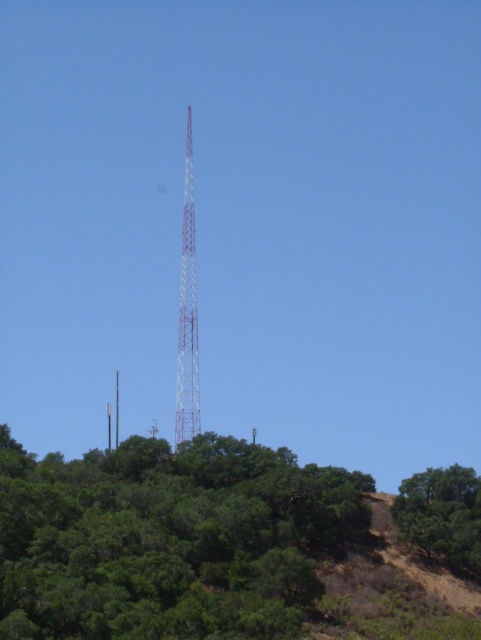
From the picture: Who is shorter, green leafy tree at center or metallic tower at center?

With less height is green leafy tree at center.

What are the coordinates of `green leafy tree at center` in the screenshot? It's located at (168, 540).

Which is behind, point (52, 596) or point (114, 435)?

The point (114, 435) is more distant.

At what (x,y) coordinates should I click in order to perform the action: click on green leafy tree at center. Please return your answer as a coordinate pair (x, y). The image size is (481, 640). Looking at the image, I should click on (168, 540).

Consider the image. Can you confirm if green leafy tree at lower right is positioned above metallic white tower at center?

Actually, green leafy tree at lower right is below metallic white tower at center.

Can you confirm if green leafy tree at lower right is positioned to the right of metallic white tower at center?

Indeed, green leafy tree at lower right is positioned on the right side of metallic white tower at center.

Is point (445, 518) positioned after point (200, 413)?

No.

The image size is (481, 640). In order to click on green leafy tree at lower right in this screenshot , I will do `click(442, 515)`.

Consider the image. Does metallic white tower at center have a smaller size compared to red painted metal tower at center?

No, metallic white tower at center is not smaller than red painted metal tower at center.

At what (x,y) coordinates should I click in order to perform the action: click on metallic white tower at center. Please return your answer as a coordinate pair (x, y). Looking at the image, I should click on (188, 312).

Is point (186, 392) positioned behind point (194, 282)?

No, it is not.

The width and height of the screenshot is (481, 640). In order to click on metallic white tower at center in this screenshot , I will do `click(188, 312)`.